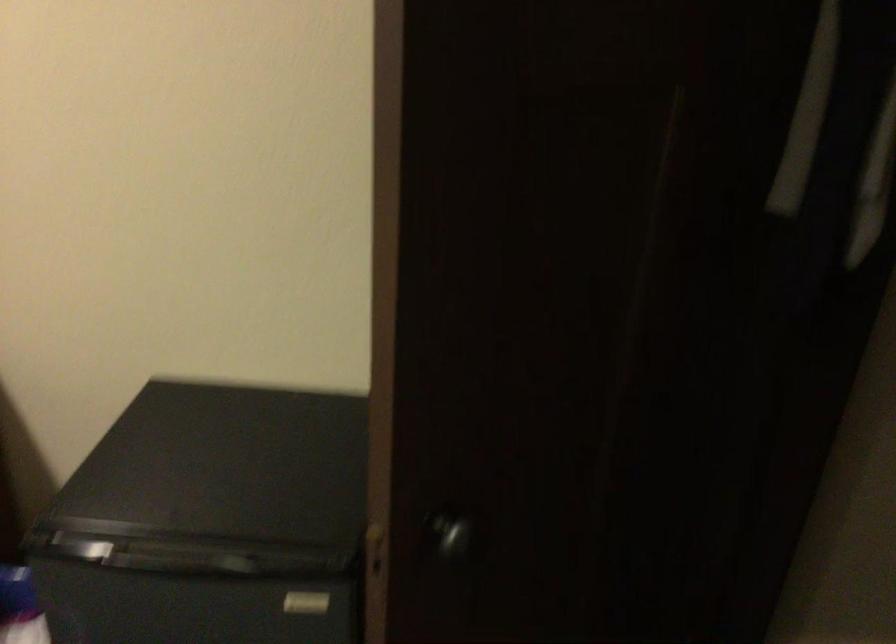
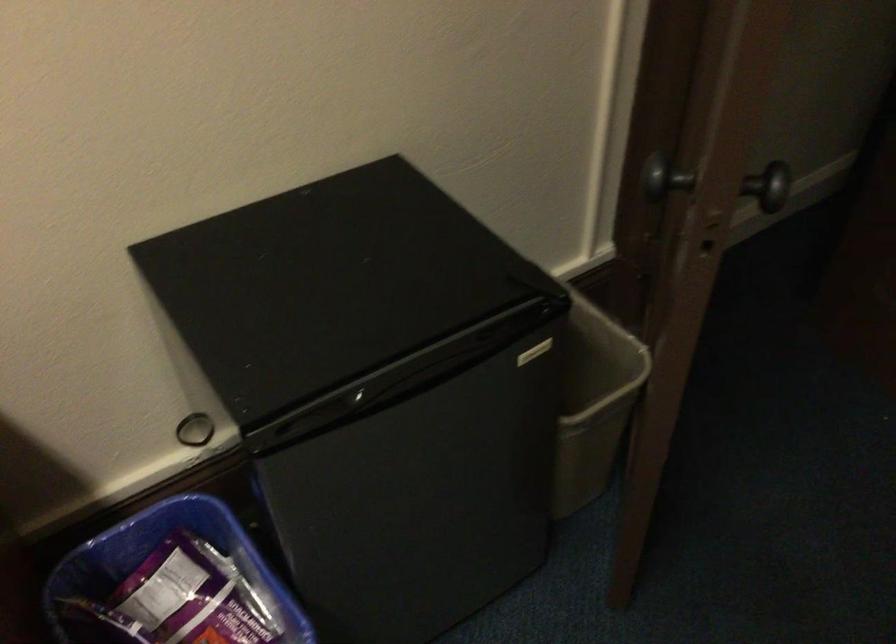
The point at (393, 471) is marked in the first image. Where is the corresponding point in the second image?

(656, 174)